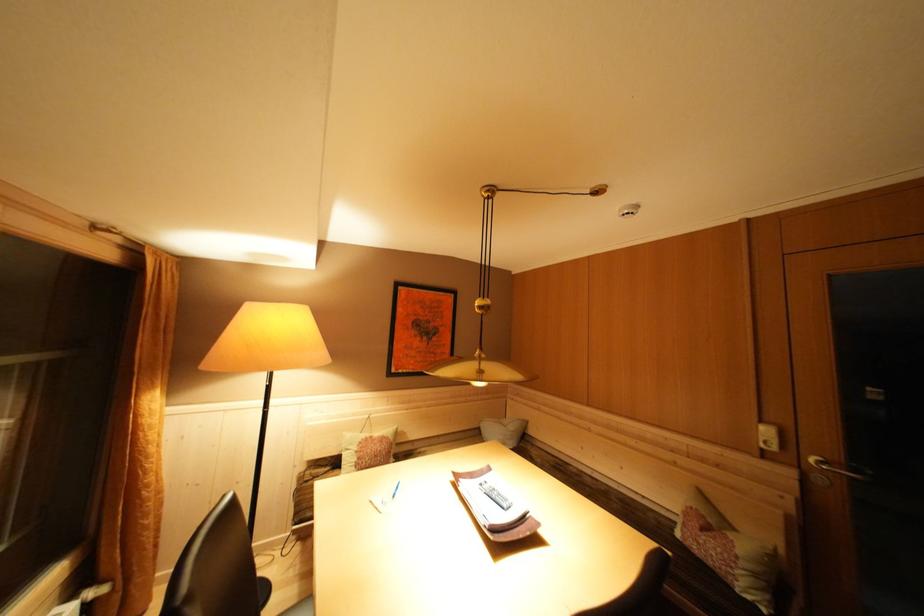
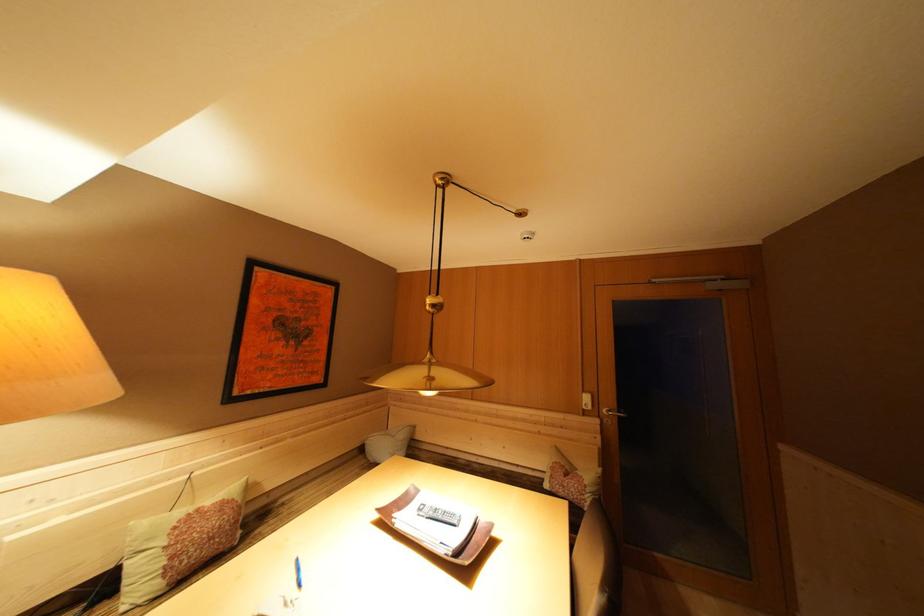
Question: The first image is from the beginning of the video and the second image is from the end. How did the camera likely rotate when shooting the video?

Choices:
 (A) Left
 (B) Right
 (C) Up
 (D) Down

Answer: (B)